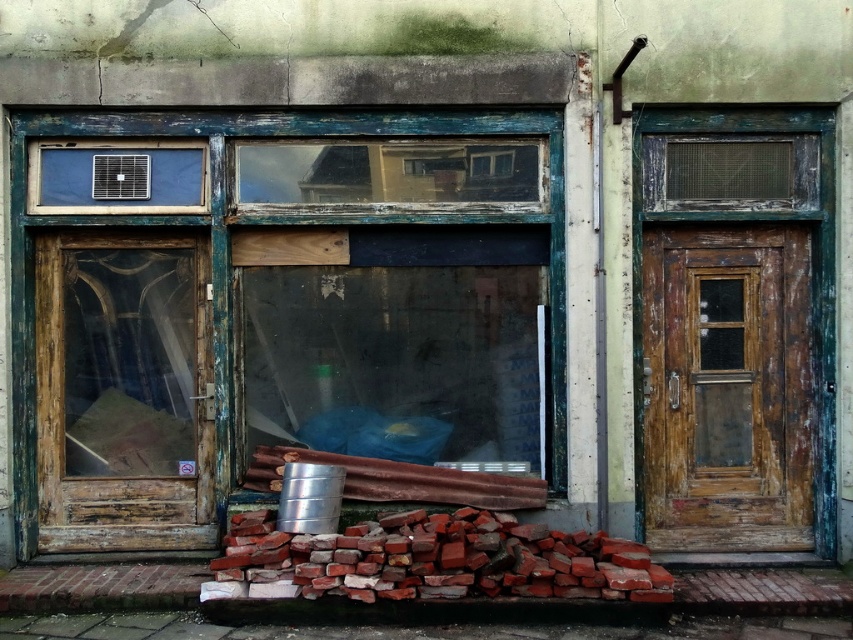
Between wooden frame window at center and wooden door at left, which one appears on the right side from the viewer's perspective?

wooden frame window at center is more to the right.

Who is higher up, wooden frame window at center or wooden door at left?

wooden frame window at center

Image resolution: width=853 pixels, height=640 pixels. In order to click on wooden frame window at center in this screenshot , I will do (273, 305).

Does wooden door at left appear on the right side of weathered wood door at right?

Incorrect, wooden door at left is not on the right side of weathered wood door at right.

Is point (122, 346) closer to viewer compared to point (689, 449)?

That is True.

Locate an element on the screen. The height and width of the screenshot is (640, 853). wooden door at left is located at coordinates (123, 390).

Who is positioned more to the right, weathered wood door at right or brick rubble at lower center?

weathered wood door at right

Locate an element on the screen. The height and width of the screenshot is (640, 853). weathered wood door at right is located at coordinates (727, 388).

Where is `weathered wood door at right`? The width and height of the screenshot is (853, 640). weathered wood door at right is located at coordinates (727, 388).